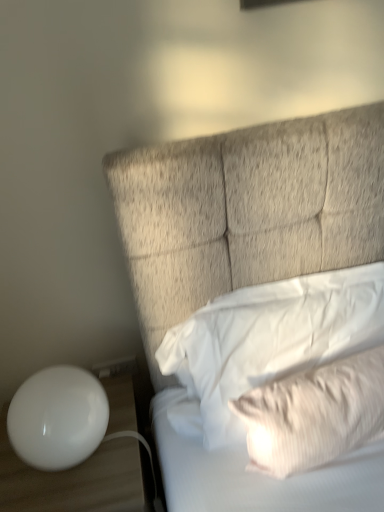
Locate an element on the screen. The width and height of the screenshot is (384, 512). white soft pillow at upper right, arranged as the 1th pillow when viewed from the top is located at coordinates (266, 342).

What do you see at coordinates (58, 418) in the screenshot? I see `white glossy sphere at lower left` at bounding box center [58, 418].

Measure the distance between point (x=118, y=490) and camera.

Point (x=118, y=490) and camera are 1.02 meters apart.

The height and width of the screenshot is (512, 384). Describe the element at coordinates (314, 414) in the screenshot. I see `white striped pillow at upper right, marked as the 2th pillow in a top-to-bottom arrangement` at that location.

Image resolution: width=384 pixels, height=512 pixels. Describe the element at coordinates (115, 367) in the screenshot. I see `white plastic electric outlet at lower left` at that location.

Where is `white soft pillow at upper right, the second pillow positioned from the bottom`? white soft pillow at upper right, the second pillow positioned from the bottom is located at coordinates (266, 342).

Which object is positioned more to the left, white striped pillow at upper right, which ranks as the first pillow in bottom-to-top order, or white glossy table at lower left?

From the viewer's perspective, white glossy table at lower left appears more on the left side.

Is white glossy table at lower left located within white striped pillow at upper right, marked as the 2th pillow in a top-to-bottom arrangement?

No, white glossy table at lower left is not inside white striped pillow at upper right, marked as the 2th pillow in a top-to-bottom arrangement.

Could you tell me if white striped pillow at upper right, which ranks as the first pillow in bottom-to-top order, is facing white glossy table at lower left?

No, white striped pillow at upper right, which ranks as the first pillow in bottom-to-top order, is not facing towards white glossy table at lower left.

Is white striped pillow at upper right, marked as the 2th pillow in a top-to-bottom arrangement, positioned behind white glossy table at lower left?

No, it is in front of white glossy table at lower left.

Considering the sizes of objects white glossy table at lower left and white striped pillow at upper right, which ranks as the first pillow in bottom-to-top order, in the image provided, who is taller, white glossy table at lower left or white striped pillow at upper right, which ranks as the first pillow in bottom-to-top order,?

white glossy table at lower left.

From a real-world perspective, which object rests below the other?

From a 3D spatial view, white glossy table at lower left is below.

Would you say white glossy table at lower left is to the left or to the right of white striped pillow at upper right, marked as the 2th pillow in a top-to-bottom arrangement, in the picture?

From the image, it's evident that white glossy table at lower left is to the left of white striped pillow at upper right, marked as the 2th pillow in a top-to-bottom arrangement.

Considering the sizes of objects white glossy table at lower left and white striped pillow at upper right, marked as the 2th pillow in a top-to-bottom arrangement, in the image provided, who is thinner, white glossy table at lower left or white striped pillow at upper right, marked as the 2th pillow in a top-to-bottom arrangement,?

white striped pillow at upper right, marked as the 2th pillow in a top-to-bottom arrangement.

Which point is more distant from viewer, (x=211, y=318) or (x=110, y=362)?

The point (x=110, y=362) is farther from the camera.

Is white soft pillow at upper right, arranged as the 1th pillow when viewed from the top, positioned beyond the bounds of white plastic electric outlet at lower left?

That's correct, white soft pillow at upper right, arranged as the 1th pillow when viewed from the top, is outside of white plastic electric outlet at lower left.

Which of these two, white soft pillow at upper right, the second pillow positioned from the bottom, or white plastic electric outlet at lower left, is bigger?

white soft pillow at upper right, the second pillow positioned from the bottom, is bigger.

Can you confirm if white glossy table at lower left is thinner than white plastic electric outlet at lower left?

In fact, white glossy table at lower left might be wider than white plastic electric outlet at lower left.

From a real-world perspective, which is physically below, white glossy table at lower left or white plastic electric outlet at lower left?

white glossy table at lower left is physically lower.

In the image, there is a white glossy table at lower left. Where is `electric outlet above it (from the image's perspective)`? electric outlet above it (from the image's perspective) is located at coordinates (115, 367).

Could you tell me if white striped pillow at upper right, which ranks as the first pillow in bottom-to-top order, is turned towards white plastic electric outlet at lower left?

No, white striped pillow at upper right, which ranks as the first pillow in bottom-to-top order, is not oriented towards white plastic electric outlet at lower left.

From a real-world perspective, is white striped pillow at upper right, which ranks as the first pillow in bottom-to-top order, positioned over white plastic electric outlet at lower left based on gravity?

Yes.

How many degrees apart are the facing directions of white striped pillow at upper right, marked as the 2th pillow in a top-to-bottom arrangement, and white plastic electric outlet at lower left?

white striped pillow at upper right, marked as the 2th pillow in a top-to-bottom arrangement, and white plastic electric outlet at lower left are facing 6.89 degrees away from each other.

Which point is more distant from viewer, (x=363, y=396) or (x=125, y=371)?

The point (x=125, y=371) is farther.

Which object is further away from the camera taking this photo, white glossy sphere at lower left or white glossy table at lower left?

white glossy table at lower left is more distant.

Does white glossy sphere at lower left have a larger size compared to white glossy table at lower left?

Incorrect, white glossy sphere at lower left is not larger than white glossy table at lower left.

Are white glossy sphere at lower left and white glossy table at lower left beside each other?

No, white glossy sphere at lower left is not next to white glossy table at lower left.

Is point (61, 407) more distant than point (84, 485)?

No.

Consider the image. From a real-world perspective, is white glossy table at lower left under white soft pillow at upper right, the second pillow positioned from the bottom?

Yes, from a real-world perspective, white glossy table at lower left is under white soft pillow at upper right, the second pillow positioned from the bottom.

Who is smaller, white glossy table at lower left or white soft pillow at upper right, arranged as the 1th pillow when viewed from the top?

white soft pillow at upper right, arranged as the 1th pillow when viewed from the top.

Considering the points (26, 479) and (331, 329), which point is behind, point (26, 479) or point (331, 329)?

The point (331, 329) is farther.

Find the location of a particular element. The width and height of the screenshot is (384, 512). the 2nd pillow above when counting from the white glossy table at lower left (from the image's perspective) is located at coordinates (266, 342).

The height and width of the screenshot is (512, 384). What are the coordinates of `table below the white striped pillow at upper right, which ranks as the first pillow in bottom-to-top order (from a real-world perspective)` in the screenshot? It's located at (78, 480).

The width and height of the screenshot is (384, 512). Find the location of `table located below the white striped pillow at upper right, marked as the 2th pillow in a top-to-bottom arrangement (from the image's perspective)`. table located below the white striped pillow at upper right, marked as the 2th pillow in a top-to-bottom arrangement (from the image's perspective) is located at coordinates (78, 480).

When comparing their distances from white striped pillow at upper right, which ranks as the first pillow in bottom-to-top order, does white glossy sphere at lower left or white plastic electric outlet at lower left seem further?

Based on the image, white plastic electric outlet at lower left appears to be further to white striped pillow at upper right, which ranks as the first pillow in bottom-to-top order.

Which object lies further to the anchor point white plastic electric outlet at lower left, white glossy sphere at lower left or white soft pillow at upper right, arranged as the 1th pillow when viewed from the top?

Based on the image, white soft pillow at upper right, arranged as the 1th pillow when viewed from the top, appears to be further to white plastic electric outlet at lower left.

Based on their spatial positions, is white striped pillow at upper right, which ranks as the first pillow in bottom-to-top order, or white soft pillow at upper right, the second pillow positioned from the bottom, closer to white glossy sphere at lower left?

Based on the image, white soft pillow at upper right, the second pillow positioned from the bottom, appears to be nearer to white glossy sphere at lower left.

Which object lies nearer to the anchor point white glossy sphere at lower left, white plastic electric outlet at lower left or white glossy table at lower left?

white glossy table at lower left is positioned closer to the anchor white glossy sphere at lower left.

Looking at the image, which one is located further to white striped pillow at upper right, marked as the 2th pillow in a top-to-bottom arrangement, white glossy table at lower left or white soft pillow at upper right, the second pillow positioned from the bottom?

white glossy table at lower left is further to white striped pillow at upper right, marked as the 2th pillow in a top-to-bottom arrangement.

Estimate the real-world distances between objects in this image. Which object is closer to white soft pillow at upper right, the second pillow positioned from the bottom, white glossy sphere at lower left or white plastic electric outlet at lower left?

white glossy sphere at lower left.

Considering their positions, is white striped pillow at upper right, which ranks as the first pillow in bottom-to-top order, positioned further to white glossy sphere at lower left than white plastic electric outlet at lower left?

Among the two, white striped pillow at upper right, which ranks as the first pillow in bottom-to-top order, is located further to white glossy sphere at lower left.

When comparing their distances from white glossy table at lower left, does white striped pillow at upper right, which ranks as the first pillow in bottom-to-top order, or white glossy sphere at lower left seem closer?

The object closer to white glossy table at lower left is white glossy sphere at lower left.

This screenshot has height=512, width=384. Identify the location of electric outlet situated between white glossy sphere at lower left and white striped pillow at upper right, which ranks as the first pillow in bottom-to-top order, from left to right. 115,367.

Image resolution: width=384 pixels, height=512 pixels. Find the location of `table between white glossy sphere at lower left and white striped pillow at upper right, marked as the 2th pillow in a top-to-bottom arrangement`. table between white glossy sphere at lower left and white striped pillow at upper right, marked as the 2th pillow in a top-to-bottom arrangement is located at coordinates (78, 480).

You are a GUI agent. You are given a task and a screenshot of the screen. Output one action in this format:
    pyautogui.click(x=<x>, y=<y>)
    Task: Click on the pillow between white glossy table at lower left and white striped pillow at upper right, marked as the 2th pillow in a top-to-bottom arrangement
    This screenshot has width=384, height=512.
    Given the screenshot: What is the action you would take?
    pyautogui.click(x=266, y=342)

Image resolution: width=384 pixels, height=512 pixels. What are the coordinates of `electric outlet between white glossy sphere at lower left and white soft pillow at upper right, the second pillow positioned from the bottom, from left to right` in the screenshot? It's located at (115, 367).